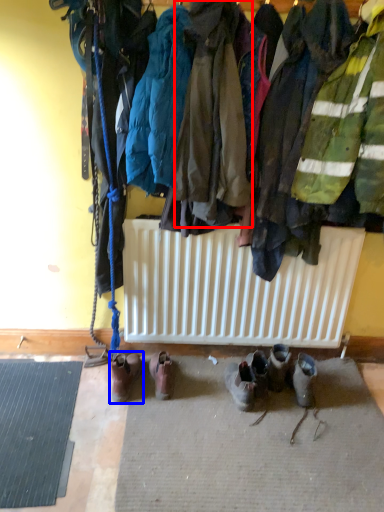
Question: Which object is further to the camera taking this photo, jacket (highlighted by a red box) or footwear (highlighted by a blue box)?

Choices:
 (A) jacket
 (B) footwear

Answer: (B)